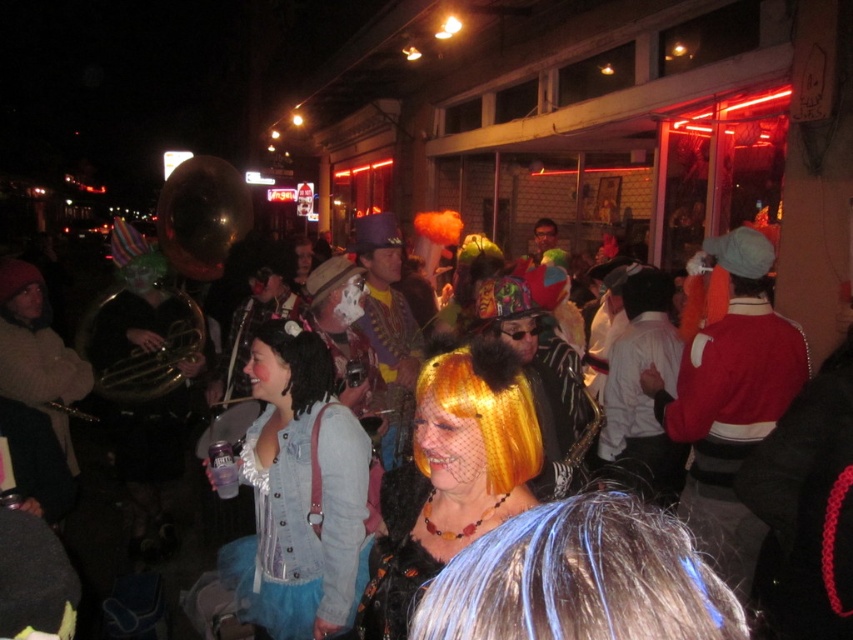
In the festive nighttime street scene with warm red neon lights, where is the blue dyed hair at center located in terms of coordinates?

The blue dyed hair at center is located at coordinates point (579, 579).

You are a photographer at the event and want to capture a closeup shot of both the blue dyed hair at center and the shiny gold wig at center. Which hairstyle should you adjust the camera focus for first if you want to ensure both are in focus?

The blue dyed hair at center has a smaller width than the shiny gold wig at center, so you should focus on the shiny gold wig at center first since it is larger and requires more precise focus to ensure clarity.